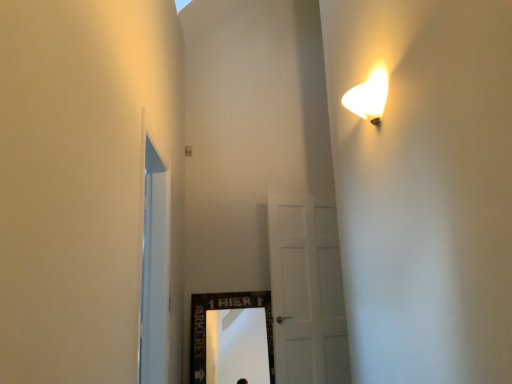
What do you see at coordinates (307, 292) in the screenshot? I see `white matte door at center` at bounding box center [307, 292].

Where is `white matte door at center`? white matte door at center is located at coordinates (307, 292).

The image size is (512, 384). Find the location of `white matte door at center`. white matte door at center is located at coordinates (307, 292).